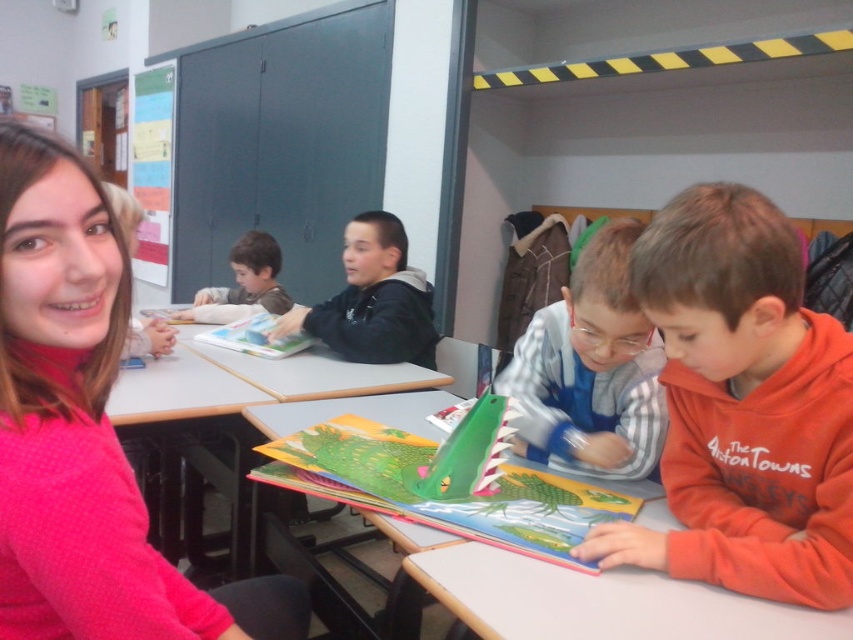
You are a student in the classroom and want to reach the hardcover book at center without moving the orange fleece sweatshirt at lower right. Is this possible?

The orange fleece sweatshirt at lower right is positioned under the hardcover book at center, so the book is above it. You can reach the hardcover book at center by extending your hand upwards since it is elevated above the sweatshirt.

Looking at the classroom scene, there is an orange fleece sweatshirt at lower right and a hardcover book at center. Which object is positioned more to the right side of the scene?

The orange fleece sweatshirt at lower right is positioned more to the right side of the scene than the hardcover book at center.

You are standing in the classroom and want to place a 5 feet long poster on the floor. The poster needs to be placed directly in front of the matte plastic table at left. Is there enough space between you and the table to lay it out fully?

The matte plastic table at left is 5.10 feet from viewer. Since the poster is 5 feet long, there is enough space to lay it out fully in front of the table.